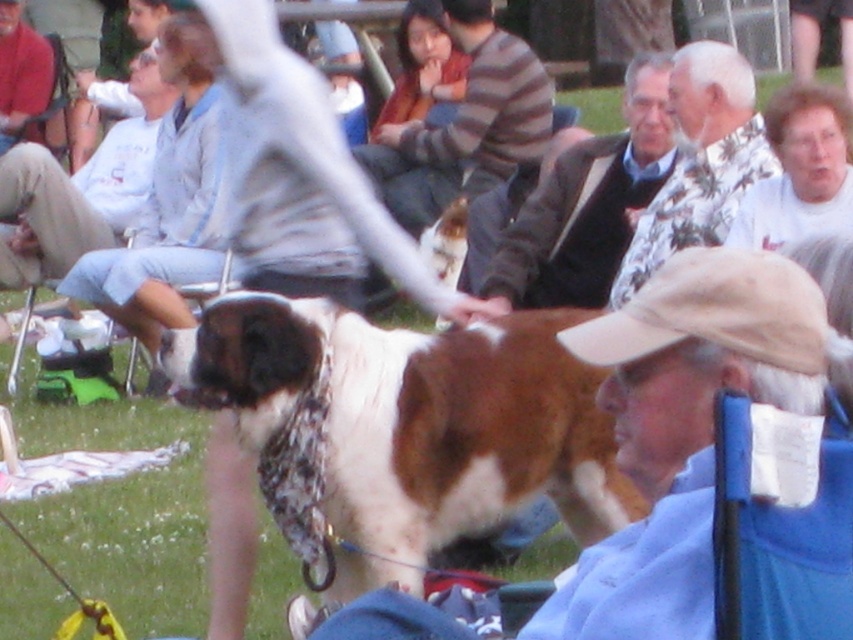
You are at an outdoor event and see two people in the upper right corner wearing shirts. One is wearing a floral shirt at upper right and the other a white cotton shirt at upper right. Which shirt is located more to the left?

The floral shirt at upper right is positioned on the left side of the white cotton shirt at upper right, so the floral shirt at upper right is more to the left.